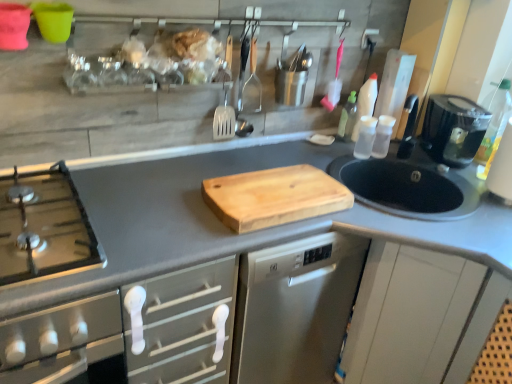
Find the location of a particular element. free space on the front side of transparent plastic bottle at upper right, which is the first bottle in left-to-right order is located at coordinates (339, 156).